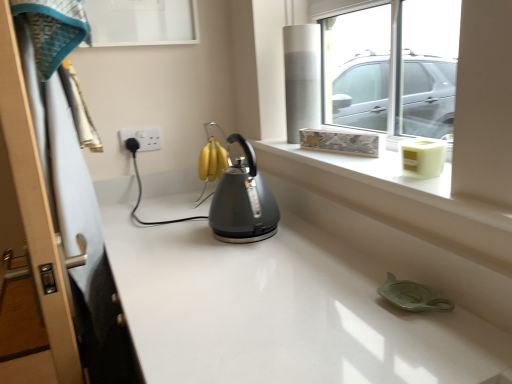
Question: From their relative heights in the image, would you say satin grey kettle at center is taller or shorter than white plastic socket at upper left?

Choices:
 (A) short
 (B) tall

Answer: (B)

Question: Is satin grey kettle at center wider or thinner than white plastic socket at upper left?

Choices:
 (A) wide
 (B) thin

Answer: (A)

Question: Which is nearer to the wooden screen door at left?

Choices:
 (A) white plastic socket at upper left
 (B) satin grey kettle at center
 (C) transparent glass window at upper center
 (D) white textured ledge at upper right

Answer: (B)

Question: Which of these objects is positioned closest to the satin grey kettle at center?

Choices:
 (A) transparent glass window at upper center
 (B) wooden screen door at left
 (C) white textured ledge at upper right
 (D) white plastic socket at upper left

Answer: (C)